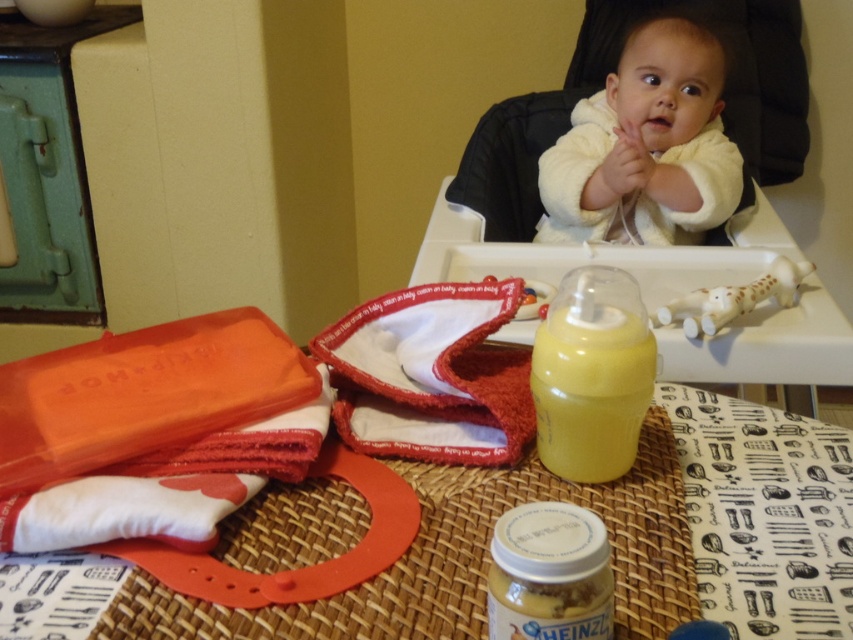
You are a caregiver in a nursery. You need to choose between the yellow translucent bottle at center and the yellow matte baby bottle at center for feeding the baby. Which bottle is taller?

The yellow translucent bottle at center is much taller than the yellow matte baby bottle at center, so it is the taller one.

You are a caregiver entering the room to feed the baby. You see the yellow matte baby bottle at center and the white plastic teething toy at upper right. Which object is shorter in height?

The yellow matte baby bottle at center is shorter in height compared to the white plastic teething toy at upper right.

You are a babysitter looking after the baby in the white fluffy baby at upper center. You notice the yellow matte baby bottle at center nearby. To reach the bottle, should you move to the left or right from the baby?

The white fluffy baby at upper center is positioned on the right side of the yellow matte baby bottle at center, so to reach the bottle, you should move to the left from the baby.